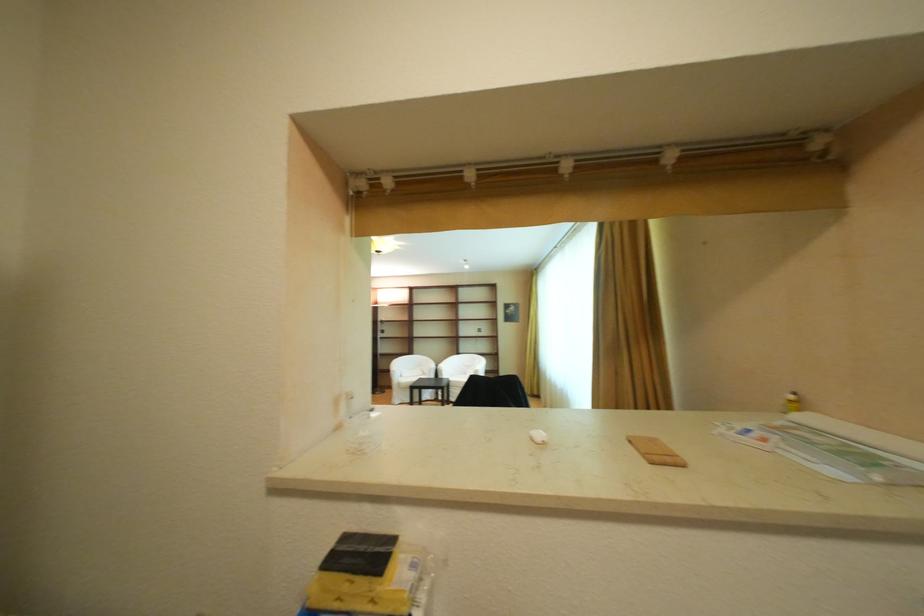
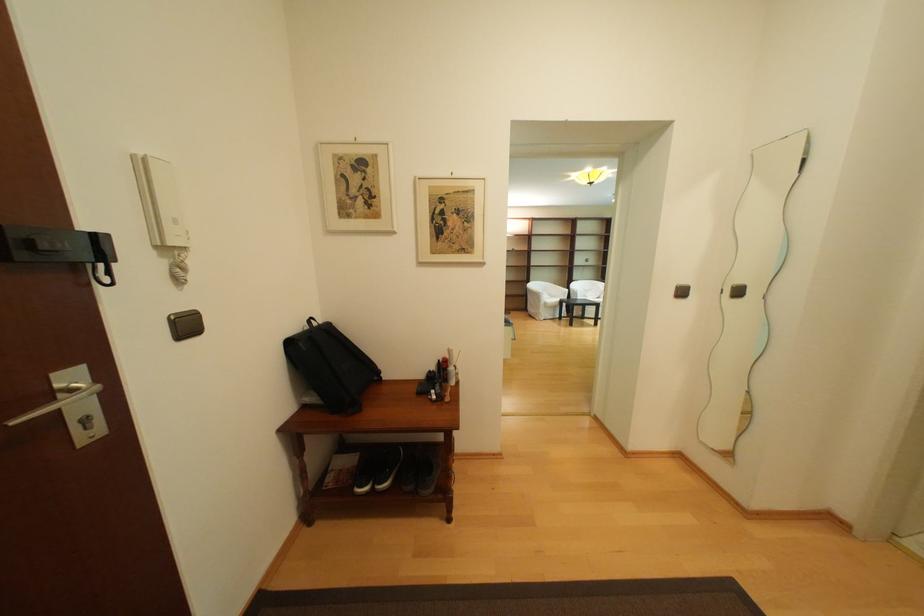
Question: What movement of the cameraman would produce the second image?

Choices:
 (A) Left
 (B) Right
 (C) Forward
 (D) Backward

Answer: (A)